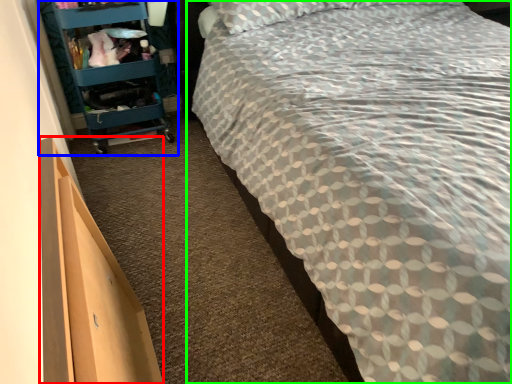
Question: Which is farther away from drawer (highlighted by a red box)? furniture (highlighted by a blue box) or bed (highlighted by a green box)?

Choices:
 (A) furniture
 (B) bed

Answer: (A)